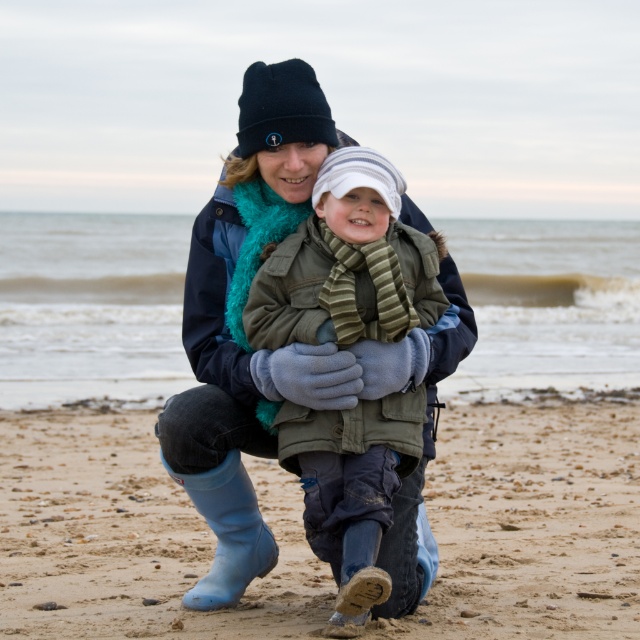
Question: Can you confirm if sandy brown at lower center is smaller than rubber boots at lower left?

Choices:
 (A) yes
 (B) no

Answer: (B)

Question: Which object appears closest to the camera in this image?

Choices:
 (A) rubber boots at lower left
 (B) sandy brown at lower center

Answer: (B)

Question: Does striped knit hat at center appear over rubber boots at lower left?

Choices:
 (A) no
 (B) yes

Answer: (B)

Question: Which of the following is the farthest from the observer?

Choices:
 (A) (6, 577)
 (B) (381, 573)
 (C) (188, 608)

Answer: (A)

Question: Estimate the real-world distances between objects in this image. Which object is farther from the sandy brown at lower center?

Choices:
 (A) rubber boots at lower left
 (B) striped knit hat at center

Answer: (B)

Question: Can you confirm if sandy brown at lower center is positioned above rubber boots at lower left?

Choices:
 (A) yes
 (B) no

Answer: (B)